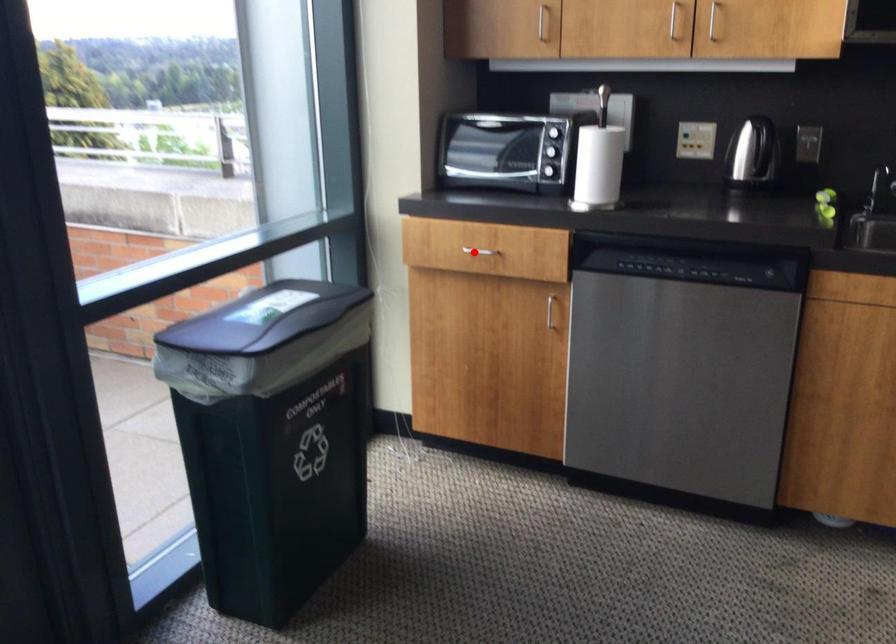
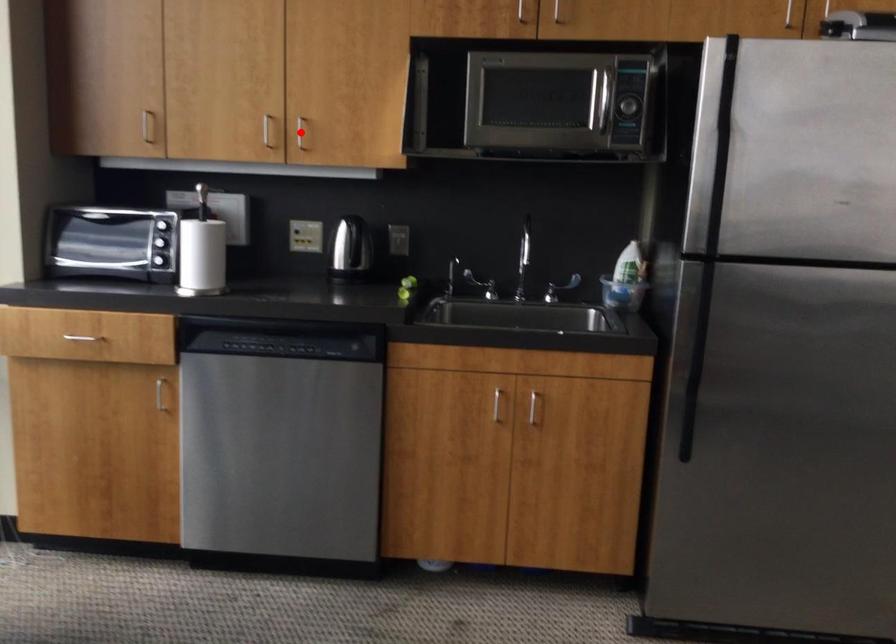
I am providing you with two images of the same scene from different viewpoints. A red point is marked on the first image and another point is marked on the second image. Do the highlighted points in image1 and image2 indicate the same real-world spot?

No